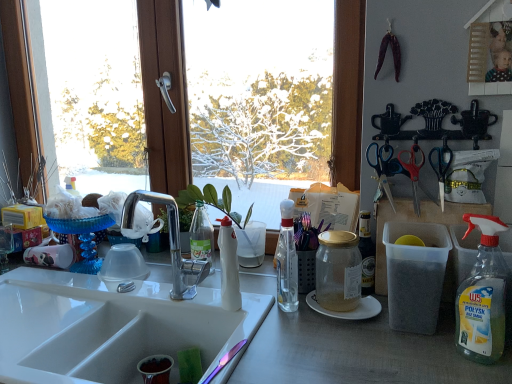
Where is `free space above white paper plate at center (from a real-world perspective)`? Image resolution: width=512 pixels, height=384 pixels. free space above white paper plate at center (from a real-world perspective) is located at coordinates (347, 309).